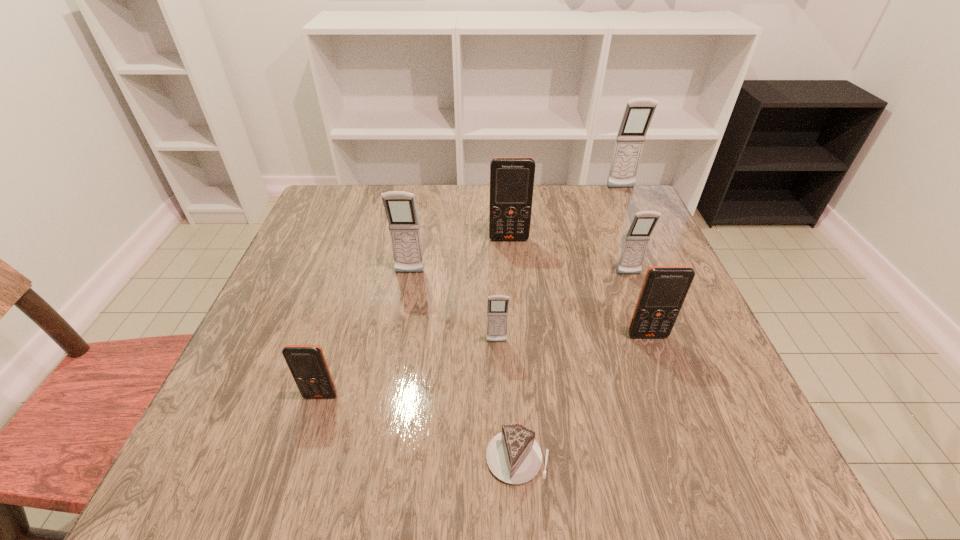
What are the coordinates of `vacant area situated on the screen of the smallest orange cellular telephone` in the screenshot? It's located at (295, 481).

What are the coordinates of `free space located on the front-facing side of the nearest gray cellular telephone` in the screenshot? It's located at (500, 425).

At what (x,y) coordinates should I click in order to perform the action: click on vacant space located 0.110m on the left of the shortest object. Please return your answer as a coordinate pair (x, y). Looking at the image, I should click on (417, 457).

You are a GUI agent. You are given a task and a screenshot of the screen. Output one action in this format:
    pyautogui.click(x=<x>, y=<y>)
    Task: Click on the object positioned at the far edge
    The image size is (960, 540).
    Given the screenshot: What is the action you would take?
    pyautogui.click(x=638, y=114)

The image size is (960, 540). Identify the location of object at the near edge. (513, 456).

What are the coordinates of `object that is positioned at the left edge` in the screenshot? It's located at (307, 363).

This screenshot has height=540, width=960. Find the location of `object that is at the far right corner`. object that is at the far right corner is located at coordinates (638, 114).

I want to click on vacant area at the far edge of the desktop, so click(483, 195).

At what (x,y) coordinates should I click in order to perform the action: click on vacant point at the near edge. Please return your answer as a coordinate pair (x, y). The image size is (960, 540). Looking at the image, I should click on [362, 454].

Where is `vacant space at the left edge`? vacant space at the left edge is located at coordinates (312, 288).